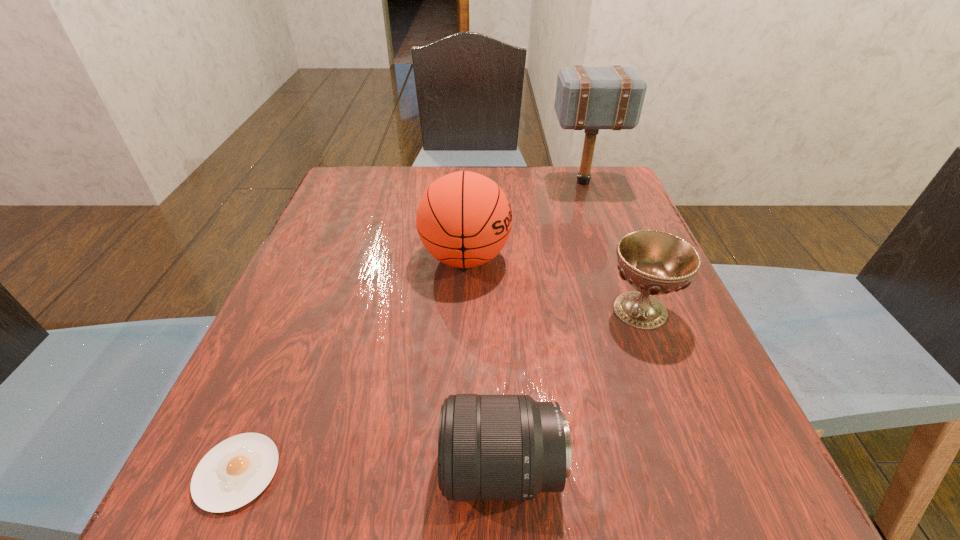
This screenshot has width=960, height=540. Find the location of `vacant space located on the side with logo of the basketball`. vacant space located on the side with logo of the basketball is located at coordinates (623, 258).

This screenshot has width=960, height=540. In order to click on free space located on the back of the chalice in this screenshot , I will do `click(619, 255)`.

The image size is (960, 540). I want to click on vacant space located on the surface of the telephoto lens, so click(x=333, y=469).

The image size is (960, 540). In order to click on vacant space located 0.290m on the surface of the telephoto lens in this screenshot , I will do `click(229, 469)`.

Identify the location of vacant point located on the surface of the telephoto lens. This screenshot has height=540, width=960. (252, 469).

The width and height of the screenshot is (960, 540). Find the location of `free space located 0.090m on the back of the egg yolk`. free space located 0.090m on the back of the egg yolk is located at coordinates (275, 383).

Find the location of a particular element. object at the far edge is located at coordinates (591, 98).

You are a GUI agent. You are given a task and a screenshot of the screen. Output one action in this format:
    pyautogui.click(x=<x>, y=<y>)
    Task: Click on the telephoto lens located in the near edge section of the desktop
    The width and height of the screenshot is (960, 540).
    Given the screenshot: What is the action you would take?
    pyautogui.click(x=490, y=447)

The image size is (960, 540). I want to click on egg yolk that is at the near edge, so click(x=233, y=473).

Locate an element on the screen. object situated at the left edge is located at coordinates (233, 473).